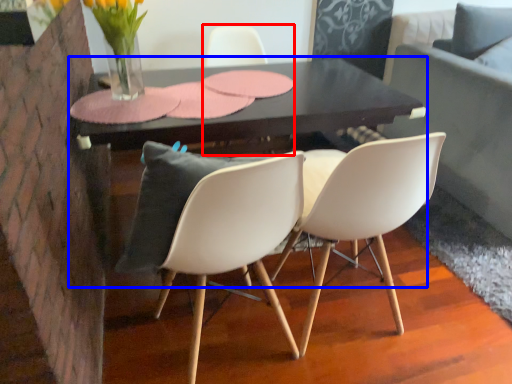
Question: Which object is closer to the camera taking this photo, chair (highlighted by a red box) or table (highlighted by a blue box)?

Choices:
 (A) chair
 (B) table

Answer: (B)